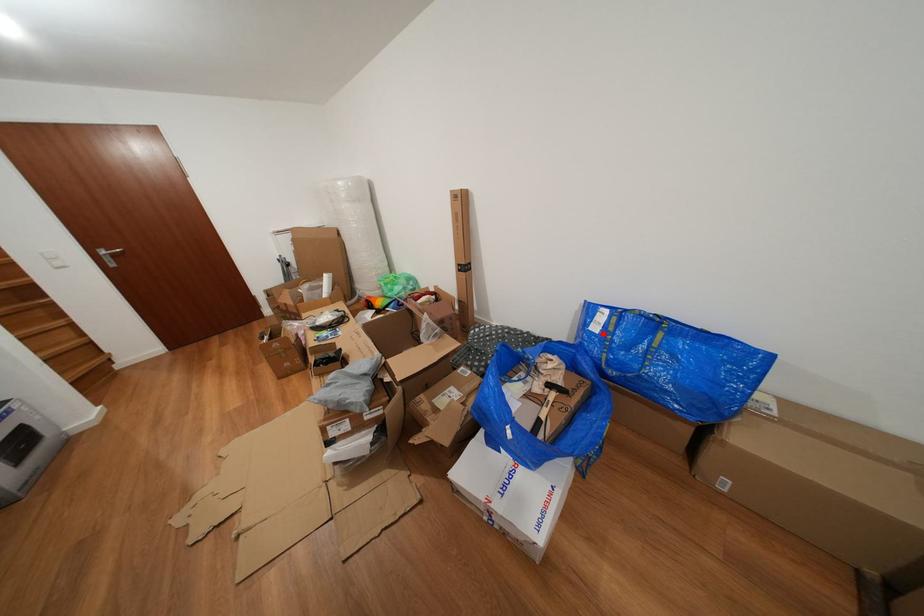
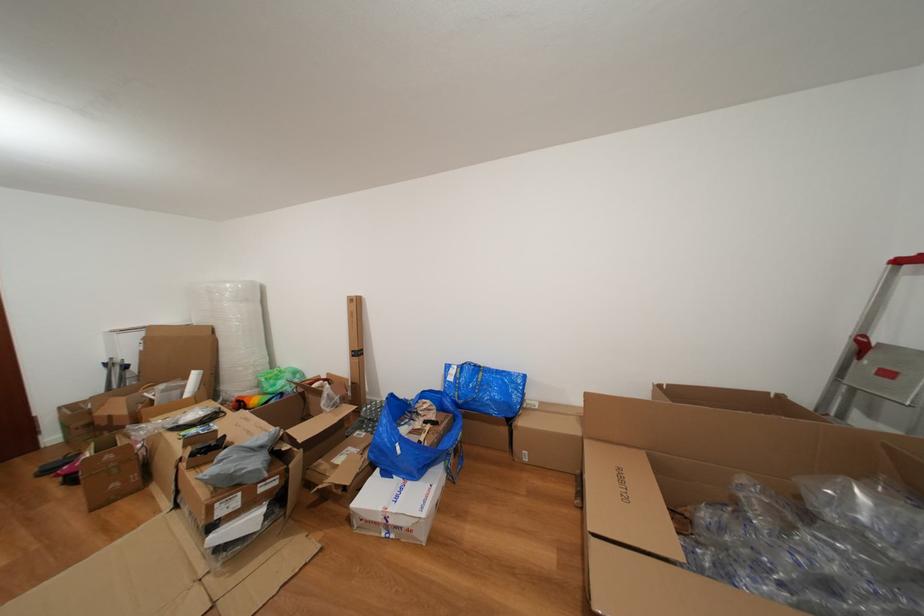
Question: A red point is marked in image1. In image2, is the corresponding 3D point closer to the camera or farther? Reply with the corresponding letter.

Choices:
 (A) The corresponding 3D point is closer.
 (B) The corresponding 3D point is farther.

Answer: (B)